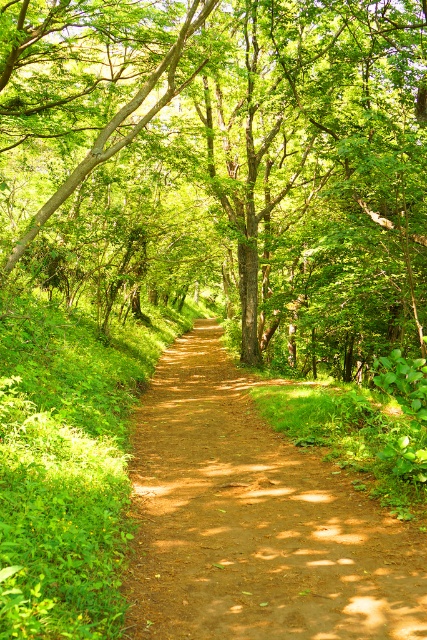
You are standing on the dirt path at center and looking towards the green leafy tree at center. Which object is taller from your perspective?

The green leafy tree at center is taller than the dirt path at center.

You are standing at the entrance of the forest path and see the green leafy tree at center. If you walk straight ahead along the path, will the tree remain in your line of sight?

The green leafy tree at center is located at point (224, 166), which means it is positioned centrally in the image. Since the path is narrow and well trodden, walking straight ahead would keep the tree in your line of sight as it is directly ahead.